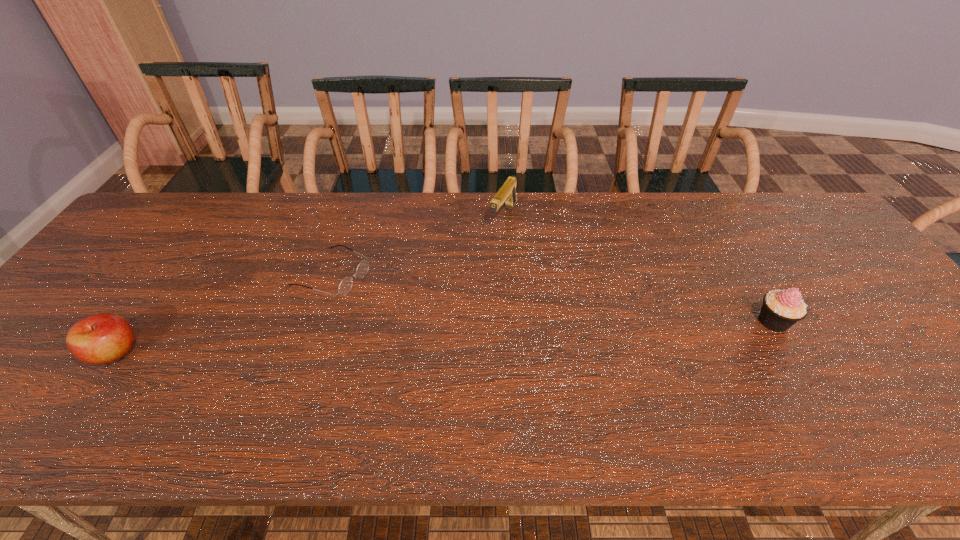
At what (x,y) coordinates should I click in order to perform the action: click on apple. Please return your answer as a coordinate pair (x, y). The height and width of the screenshot is (540, 960). Looking at the image, I should click on (102, 338).

Where is `the rightmost object`? Image resolution: width=960 pixels, height=540 pixels. the rightmost object is located at coordinates (781, 309).

Where is `the third object from left to right`? the third object from left to right is located at coordinates (507, 193).

At what (x,y) coordinates should I click in order to perform the action: click on the farthest object. Please return your answer as a coordinate pair (x, y). This screenshot has width=960, height=540. Looking at the image, I should click on click(x=507, y=193).

Find the location of a particular element. The image size is (960, 540). the second farthest object is located at coordinates (345, 286).

In order to click on the second object from left to right in this screenshot , I will do `click(345, 286)`.

Where is `free location located on the stem of the apple`? free location located on the stem of the apple is located at coordinates (309, 353).

Image resolution: width=960 pixels, height=540 pixels. Find the location of `vacant space located 0.220m on the back of the rightmost object`. vacant space located 0.220m on the back of the rightmost object is located at coordinates (731, 250).

This screenshot has width=960, height=540. I want to click on free space located 0.280m at the barrel of the farthest object, so click(x=457, y=294).

Where is `free space located at the barrel of the farthest object`? free space located at the barrel of the farthest object is located at coordinates (475, 267).